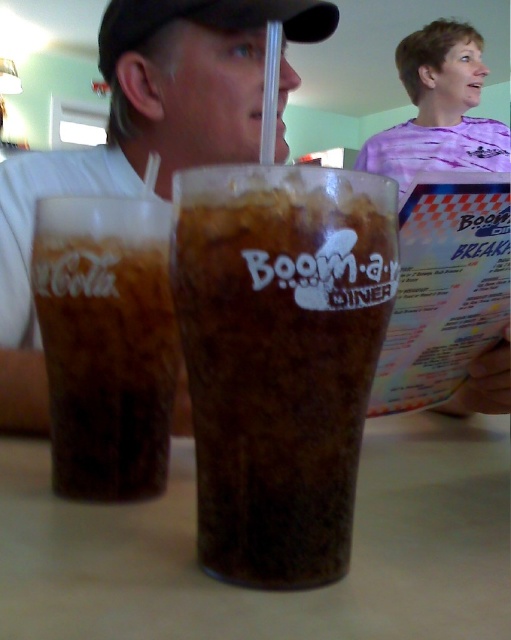
Question: Is matte plastic cup at center bigger than dark brown glass at center?

Choices:
 (A) no
 (B) yes

Answer: (B)

Question: Based on their relative distances, which object is farther from the brown frothy drink at center?

Choices:
 (A) dark brown glass at center
 (B) matte plastic cup at center

Answer: (B)

Question: Which of these objects is positioned closest to the brown frothy drink at center?

Choices:
 (A) dark brown glass at center
 (B) matte plastic cup at center

Answer: (A)

Question: Which point appears farthest from the camera in this image?

Choices:
 (A) (150, 401)
 (B) (82, 166)

Answer: (B)

Question: In this image, where is brown frothy drink at center located relative to matte plastic cup at center?

Choices:
 (A) left
 (B) right

Answer: (B)

Question: Is brown frothy drink at center further to camera compared to matte plastic cup at center?

Choices:
 (A) yes
 (B) no

Answer: (B)